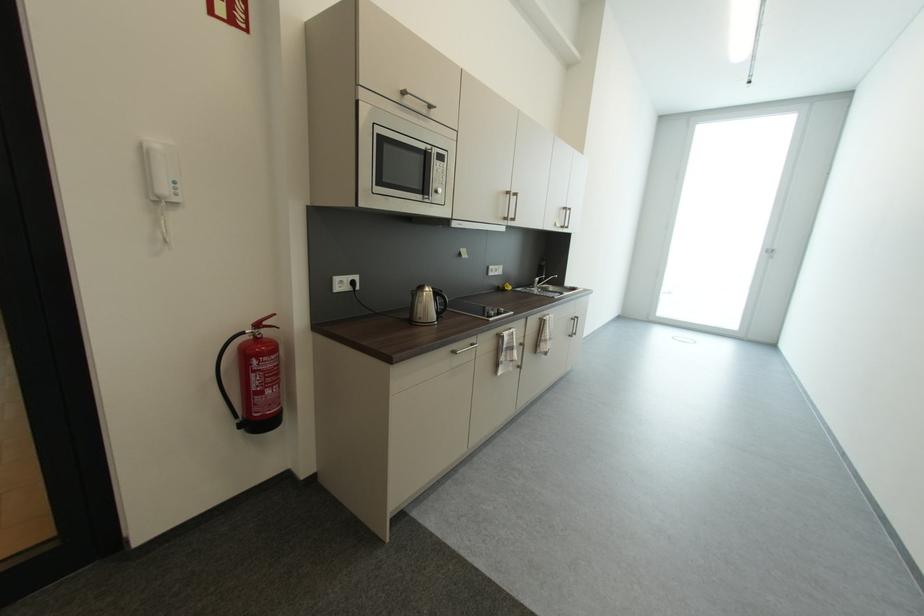
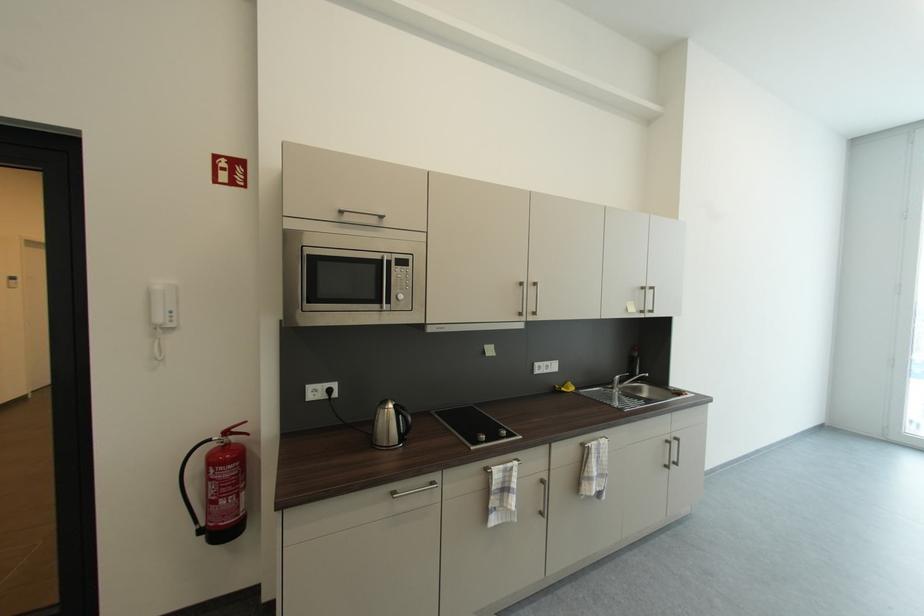
Where in the second image is the point corresponding to (445,172) from the first image?

(407, 278)